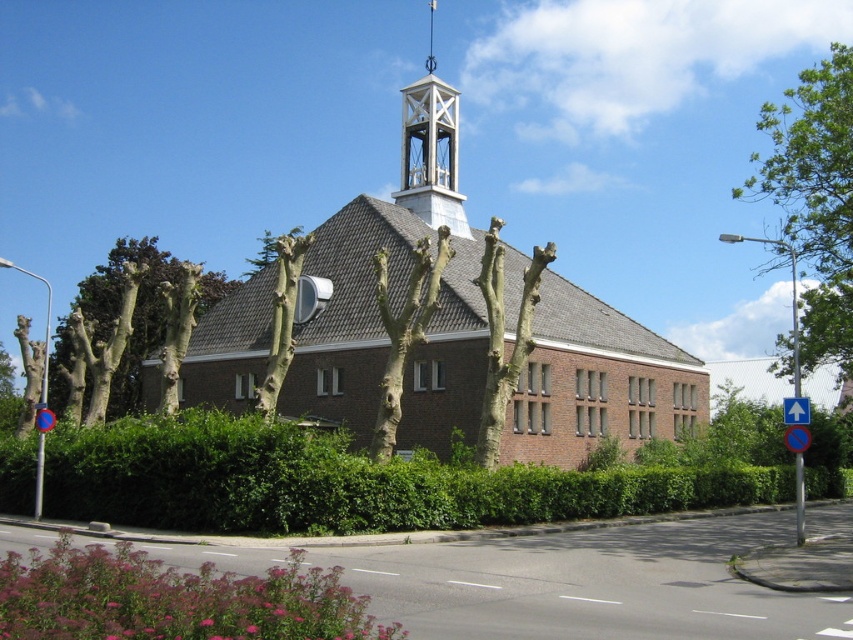
Question: Which point appears closest to the camera in this image?

Choices:
 (A) (39, 445)
 (B) (334, 589)
 (C) (802, 416)

Answer: (B)

Question: Does green leafy tree at upper right have a lesser width compared to bare bark tree at center?

Choices:
 (A) no
 (B) yes

Answer: (A)

Question: Does green leafy tree at upper right appear over white wooden bell tower at upper center?

Choices:
 (A) no
 (B) yes

Answer: (A)

Question: Which object is closer to the camera taking this photo?

Choices:
 (A) bare wood tree at center
 (B) green leafy tree at upper right
 (C) green leafy hedge at center

Answer: (C)

Question: Does green leafy hedge at center have a larger size compared to bare branches at center?

Choices:
 (A) yes
 (B) no

Answer: (B)

Question: Based on their relative distances, which object is farther from the green leafy tree at left?

Choices:
 (A) bare bark tree at center
 (B) white wooden bell tower at upper center
 (C) blue circular sign at left
 (D) bare wood tree at center

Answer: (B)